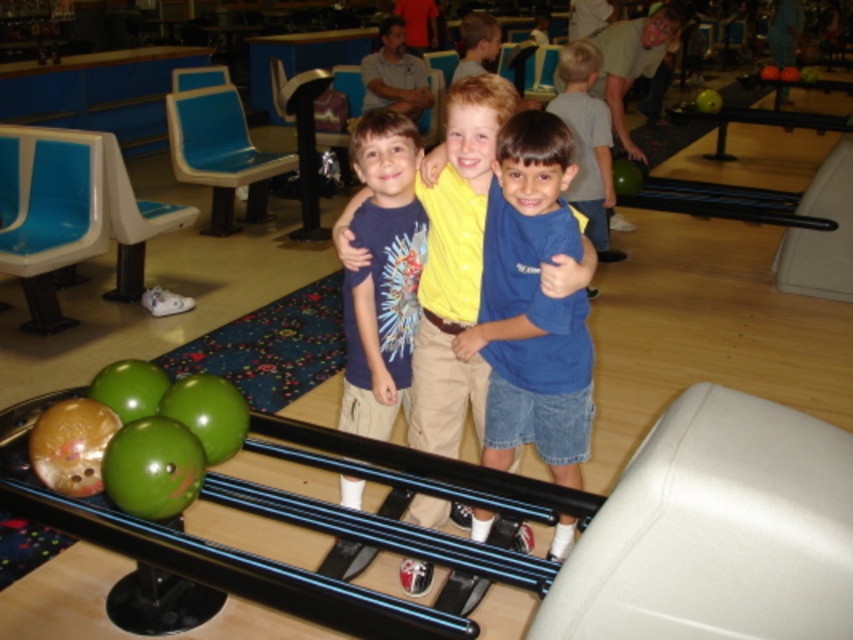
Is blue denim shorts at center wider than blue cotton shirt at center?

Indeed, blue denim shorts at center has a greater width compared to blue cotton shirt at center.

Can you confirm if blue denim shorts at center is positioned to the right of blue cotton shirt at center?

Yes, blue denim shorts at center is to the right of blue cotton shirt at center.

You are a GUI agent. You are given a task and a screenshot of the screen. Output one action in this format:
    pyautogui.click(x=<x>, y=<y>)
    Task: Click on the blue denim shorts at center
    
    Given the screenshot: What is the action you would take?
    pyautogui.click(x=531, y=307)